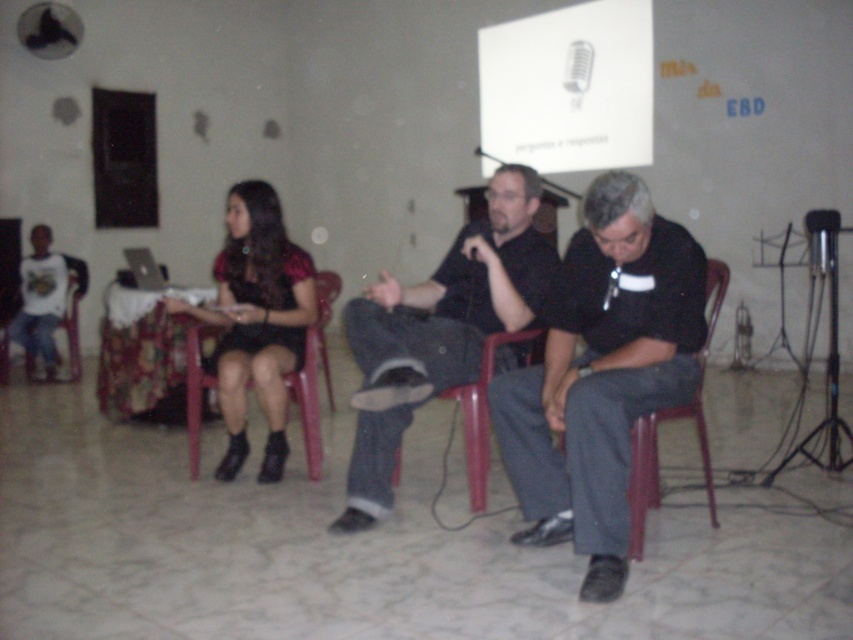
Consider the image. Is dark gray jeans at center thinner than red plastic chair at center?

No.

Can you confirm if dark gray jeans at center is bigger than red plastic chair at center?

Yes.

Does point (392, 392) come in front of point (471, 508)?

Yes.

Where is `dark gray jeans at center`? dark gray jeans at center is located at coordinates (439, 330).

Who is lower down, matte black dress at left or red plastic chair at center?

Positioned lower is red plastic chair at center.

Is matte black dress at left shorter than red plastic chair at center?

No.

The image size is (853, 640). Describe the element at coordinates (256, 321) in the screenshot. I see `matte black dress at left` at that location.

Locate an element on the screen. The width and height of the screenshot is (853, 640). matte black dress at left is located at coordinates (256, 321).

Does dark gray jeans at center appear on the right side of red plastic chair at lower right?

No, dark gray jeans at center is not to the right of red plastic chair at lower right.

Who is more forward, (x=529, y=227) or (x=711, y=481)?

Point (x=711, y=481)

At what (x,y) coordinates should I click in order to perform the action: click on dark gray jeans at center. Please return your answer as a coordinate pair (x, y). Looking at the image, I should click on (439, 330).